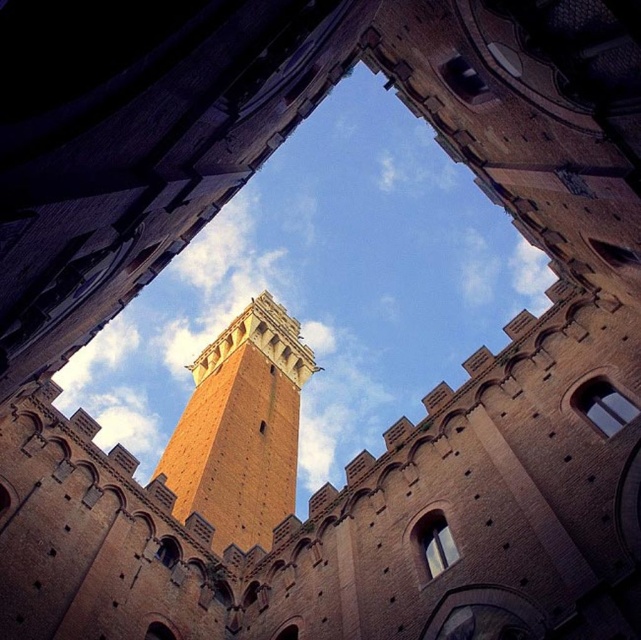
Between brick tower at center and matte glass window at center, which one has more height?

Standing taller between the two is brick tower at center.

Is brick tower at center shorter than matte glass window at center?

Incorrect, brick tower at center's height does not fall short of matte glass window at center's.

Is point (271, 524) farther from camera compared to point (619, 424)?

Yes, it is.

I want to click on brick tower at center, so click(240, 428).

Does matte glass window at center appear under clear glass window at center?

No, matte glass window at center is not below clear glass window at center.

Which of these two, matte glass window at center or clear glass window at center, stands shorter?

clear glass window at center is shorter.

Who is more distant from viewer, (619, 426) or (445, 557)?

The point (445, 557) is more distant.

Find the location of `matte glass window at center`. matte glass window at center is located at coordinates (603, 404).

Between brick tower at center and clear glass window at center, which one is positioned lower?

clear glass window at center is below.

Where is `brick tower at center`? brick tower at center is located at coordinates (240, 428).

Measure the distance between point (217, 346) and camera.

175.66 meters

The width and height of the screenshot is (641, 640). I want to click on brick tower at center, so click(240, 428).